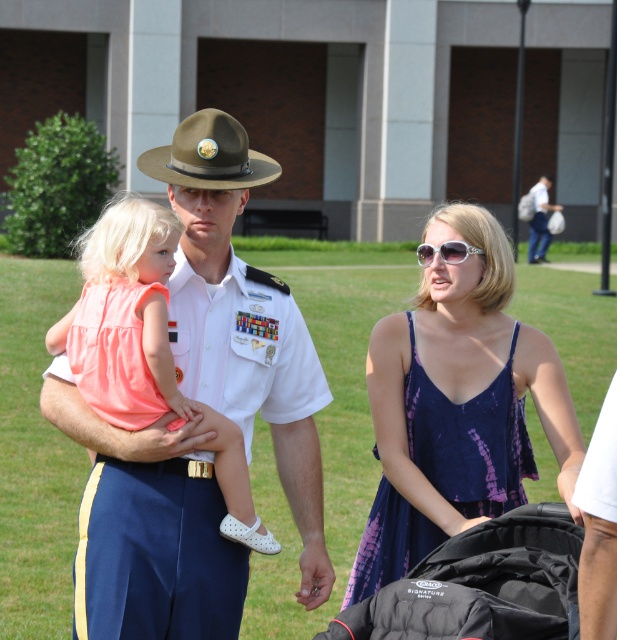
You are a photographer positioned at point 0.0, 0.0 in the scene. You need to take a photo of the white uniform at center. What are the coordinates to aim your camera at?

The coordinates to aim your camera at are (242, 323) to capture the white uniform at center.

You are a photographer at the event and need to capture a photo where both the white uniform at center and the white cotton shirt at upper right are visible. Given their heights, which object should be placed closer to the camera to ensure both are fully visible in the frame?

The white uniform at center is taller than the white cotton shirt at upper right. To ensure both are fully visible, the white cotton shirt at upper right should be placed closer to the camera so that the taller white uniform at center can be captured without being cropped.